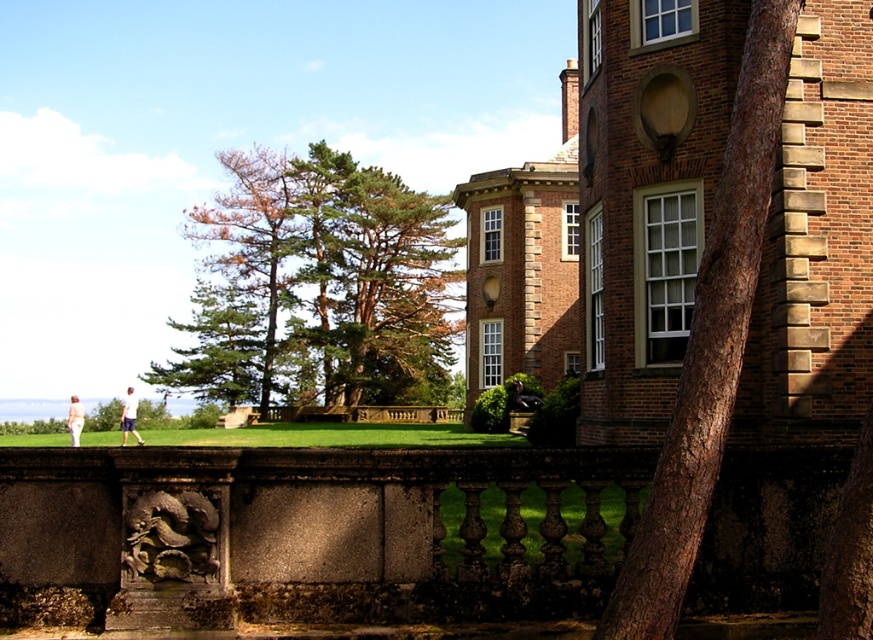
Question: Is green needle-like foliage at center bigger than white cotton shirt at lower left?

Choices:
 (A) yes
 (B) no

Answer: (A)

Question: Does matte black statue at lower center appear on the left side of white cotton shirt at lower left?

Choices:
 (A) yes
 (B) no

Answer: (B)

Question: Which object is the closest to the green needle-like foliage at center?

Choices:
 (A) white cotton shirt at lower left
 (B) matte black statue at lower center
 (C) pink fabric pants at lower left

Answer: (A)

Question: From the image, what is the correct spatial relationship of green needle-like foliage at center in relation to matte black statue at lower center?

Choices:
 (A) right
 (B) left

Answer: (B)

Question: Among these points, which one is nearest to the camera?

Choices:
 (A) (292, 390)
 (B) (509, 404)
 (C) (78, 442)

Answer: (B)

Question: Which point appears farthest from the camera in this image?

Choices:
 (A) (129, 416)
 (B) (297, 257)
 (C) (537, 396)
 (D) (76, 436)

Answer: (B)